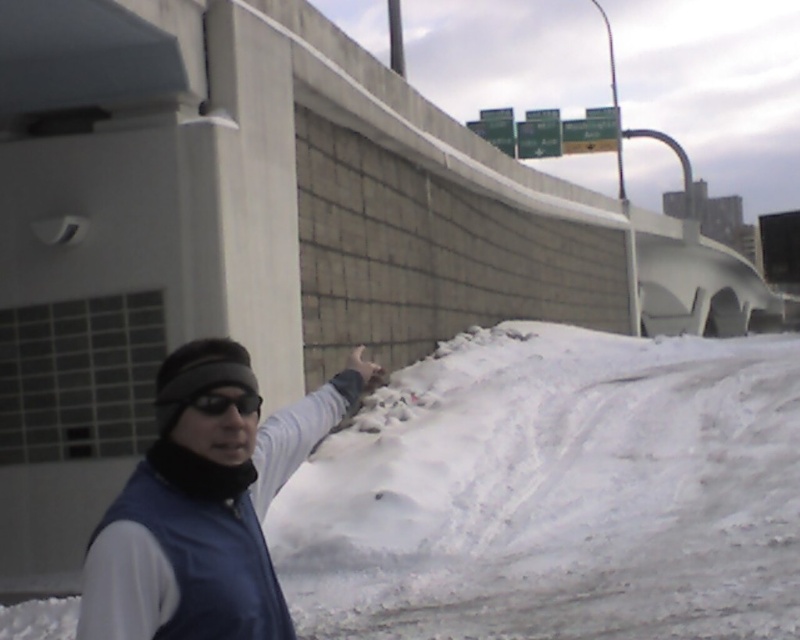
Consider the image. You are a photographer trying to capture the blue fabric jacket at center and the white matte hand at upper right in the same frame. Based on their sizes in the image, which object should you focus on first to ensure both are in focus?

The blue fabric jacket at center is much taller than the white matte hand at upper right, so focusing on the blue fabric jacket at center first will ensure both objects are in focus since it is larger and closer to the camera.

You are a photographer trying to capture the blue fabric jacket at center in your shot. Your camera is currently positioned 2.03 meters away from the jacket. Is this distance sufficient to ensure the jacket fills the frame adequately?

The blue fabric jacket at center and camera are 2.03 meters apart from each other. Whether this distance is sufficient depends on the lens focal length and sensor size of your camera. A shorter focal length might require being closer, while a longer focal length could allow capturing the jacket at this distance. Adjust your equipment accordingly.